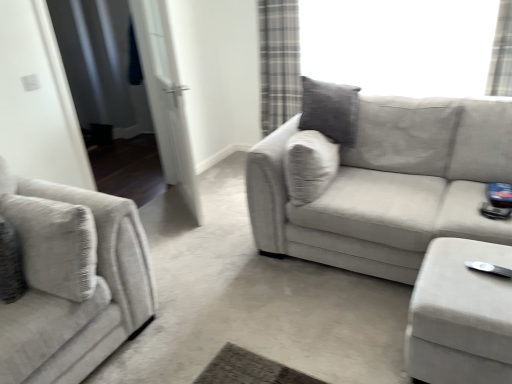
Question: Is velvet beige ottoman at lower right a part of plaid fabric curtain at upper right?

Choices:
 (A) yes
 (B) no

Answer: (B)

Question: Does plaid fabric curtain at upper right have a lesser height compared to velvet beige ottoman at lower right?

Choices:
 (A) yes
 (B) no

Answer: (B)

Question: Is plaid fabric curtain at upper right further to the viewer compared to velvet beige ottoman at lower right?

Choices:
 (A) yes
 (B) no

Answer: (A)

Question: Is plaid fabric curtain at upper right looking in the opposite direction of velvet beige ottoman at lower right?

Choices:
 (A) no
 (B) yes

Answer: (A)

Question: From the image's perspective, is plaid fabric curtain at upper right on top of velvet beige ottoman at lower right?

Choices:
 (A) no
 (B) yes

Answer: (B)

Question: From the image's perspective, is plaid fabric curtain at upper right located beneath velvet beige ottoman at lower right?

Choices:
 (A) yes
 (B) no

Answer: (B)

Question: Is the surface of white plastic wii controller at lower right in direct contact with textured beige couch at center, which ranks as the second studio couch in left-to-right order?

Choices:
 (A) yes
 (B) no

Answer: (B)

Question: Is white plastic wii controller at lower right bigger than textured beige couch at center, which ranks as the second studio couch in left-to-right order?

Choices:
 (A) yes
 (B) no

Answer: (B)

Question: Is white plastic wii controller at lower right shorter than textured beige couch at center, which ranks as the second studio couch in left-to-right order?

Choices:
 (A) no
 (B) yes

Answer: (B)

Question: Is white plastic wii controller at lower right turned away from textured beige couch at center, which ranks as the second studio couch in left-to-right order?

Choices:
 (A) yes
 (B) no

Answer: (A)

Question: Does white plastic wii controller at lower right appear on the left side of textured beige couch at center, marked as the first studio couch in a right-to-left arrangement?

Choices:
 (A) no
 (B) yes

Answer: (A)

Question: Can textured beige couch at center, marked as the first studio couch in a right-to-left arrangement, be found inside white plastic wii controller at lower right?

Choices:
 (A) yes
 (B) no

Answer: (B)

Question: Considering the relative sizes of white plastic wii controller at lower right and textured gray couch at left, the 1th studio couch from the left, in the image provided, is white plastic wii controller at lower right smaller than textured gray couch at left, the 1th studio couch from the left,?

Choices:
 (A) no
 (B) yes

Answer: (B)